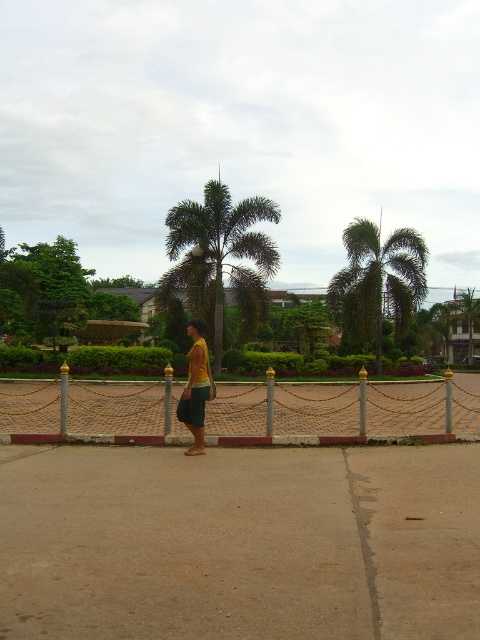
Question: Which of the following is the closest to the observer?

Choices:
 (A) (186, 396)
 (B) (189, 300)
 (C) (432, 420)

Answer: (A)

Question: Which object is positioned farthest from the green leafy palm at center?

Choices:
 (A) yellow matte shirt at center
 (B) brown concrete pavement at center
 (C) gold chain-link fence at center
 (D) green leafy palm tree at center

Answer: (B)

Question: Among these points, which one is nearest to the camera?

Choices:
 (A) (60, 516)
 (B) (206, 305)

Answer: (A)

Question: Is gold chain-link fence at center thinner than green leafy palm tree at center?

Choices:
 (A) yes
 (B) no

Answer: (B)

Question: Considering the relative positions of green leafy palm at center and green leafy palm tree at center in the image provided, where is green leafy palm at center located with respect to green leafy palm tree at center?

Choices:
 (A) below
 (B) above

Answer: (B)

Question: From the image, what is the correct spatial relationship of green leafy palm tree at center in relation to yellow matte shirt at center?

Choices:
 (A) left
 (B) right

Answer: (B)